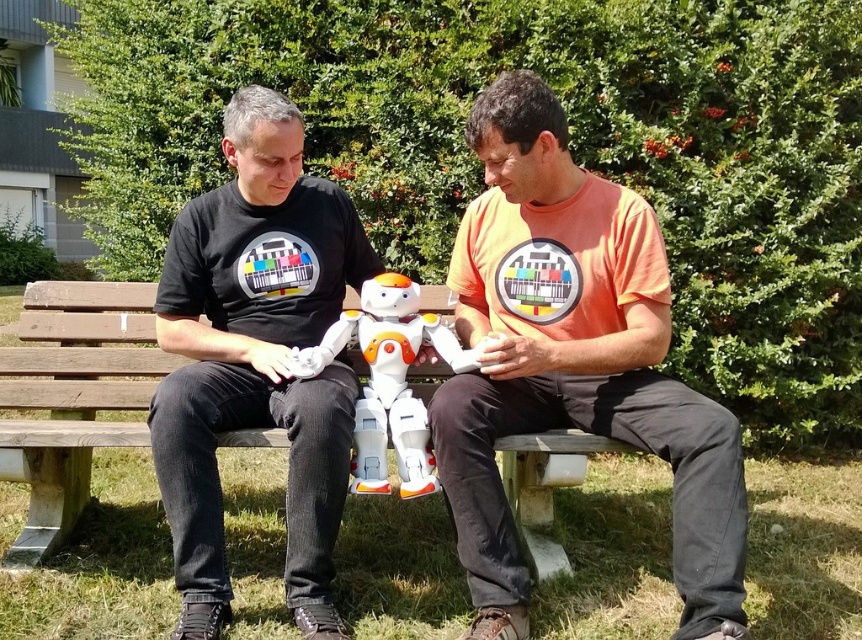
Question: Does orange cotton t-shirt at center appear over white plastic robot at center?

Choices:
 (A) no
 (B) yes

Answer: (B)

Question: Can you confirm if wooden bench at center is thinner than white plastic robot at center?

Choices:
 (A) yes
 (B) no

Answer: (B)

Question: Estimate the real-world distances between objects in this image. Which object is farther from the white plastic robot at center?

Choices:
 (A) wooden bench at center
 (B) orange cotton t-shirt at center
 (C) black matte shirt at left

Answer: (A)

Question: Which point is closer to the camera?

Choices:
 (A) white plastic robot at center
 (B) orange cotton t-shirt at center
 (C) wooden bench at center
 (D) black matte shirt at left

Answer: (B)

Question: Estimate the real-world distances between objects in this image. Which object is closer to the white plastic robot at center?

Choices:
 (A) orange cotton t-shirt at center
 (B) black matte shirt at left

Answer: (B)

Question: Is orange cotton t-shirt at center closer to camera compared to black matte shirt at left?

Choices:
 (A) yes
 (B) no

Answer: (A)